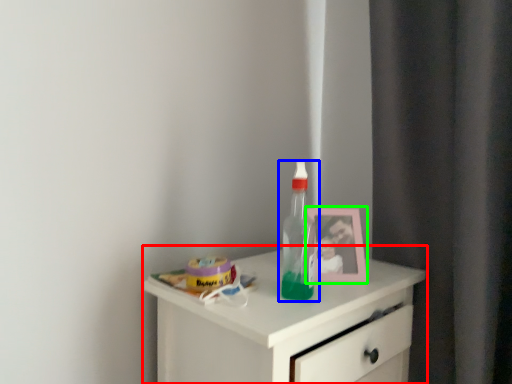
Question: Which object is positioned farthest from chest of drawers (highlighted by a red box)? Select from bottle (highlighted by a blue box) and picture frame (highlighted by a green box).

Choices:
 (A) bottle
 (B) picture frame

Answer: (B)